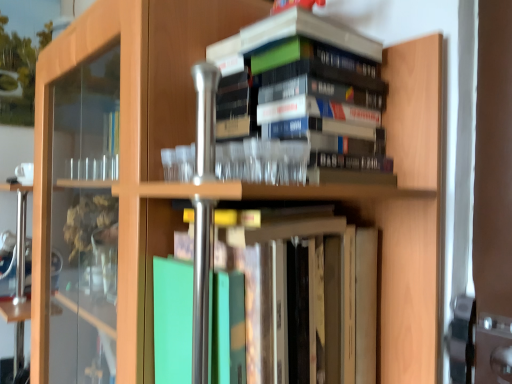
Question: From a real-world perspective, is hardcover books at upper center, which is the 2th book in bottom-to-top order, physically located above or below green matte book at center, arranged as the second book when viewed from the top?

Choices:
 (A) above
 (B) below

Answer: (A)

Question: From their relative heights in the image, would you say hardcover books at upper center, the 1th book viewed from the top, is taller or shorter than green matte book at center, acting as the first book starting from the bottom?

Choices:
 (A) short
 (B) tall

Answer: (A)

Question: Is point (256, 26) positioned closer to the camera than point (287, 355)?

Choices:
 (A) farther
 (B) closer

Answer: (A)

Question: In terms of height, does green matte book at center, arranged as the second book when viewed from the top, look taller or shorter compared to hardcover books at upper center, the 1th book viewed from the top?

Choices:
 (A) tall
 (B) short

Answer: (A)

Question: Based on their sizes in the image, would you say green matte book at center, arranged as the second book when viewed from the top, is bigger or smaller than hardcover books at upper center, the 1th book viewed from the top?

Choices:
 (A) big
 (B) small

Answer: (A)

Question: Considering their positions, is green matte book at center, acting as the first book starting from the bottom, located in front of or behind hardcover books at upper center, the 1th book viewed from the top?

Choices:
 (A) front
 (B) behind

Answer: (A)

Question: Is green matte book at center, arranged as the second book when viewed from the top, situated inside hardcover books at upper center, the 1th book viewed from the top, or outside?

Choices:
 (A) outside
 (B) inside

Answer: (A)